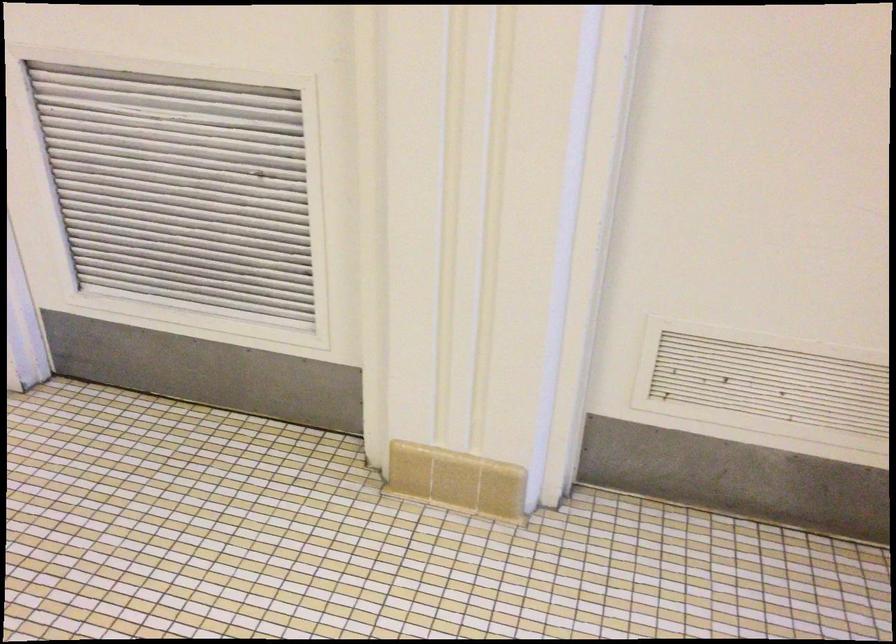
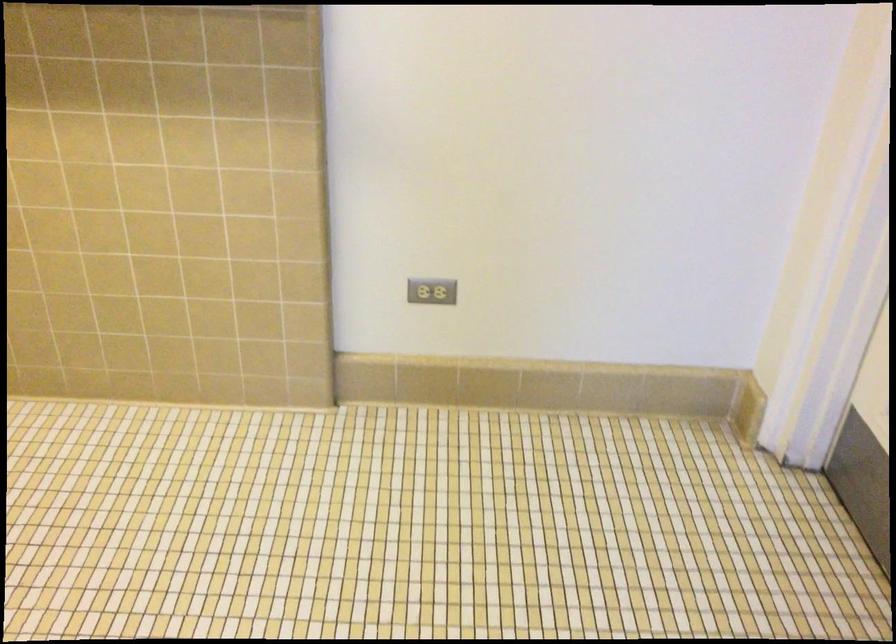
Looking at this image, how did the camera likely rotate?

The camera rotated toward left-down.